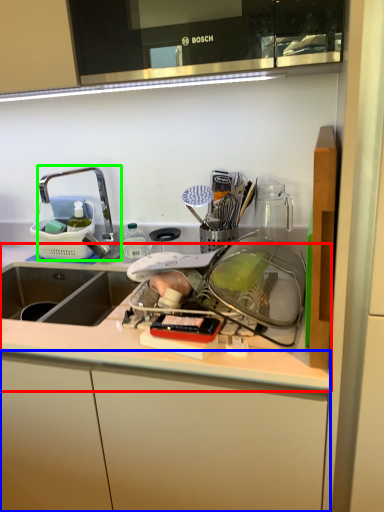
Question: Which object is the farthest from countertop (highlighted by a red box)? Choose among these: cabinetry (highlighted by a blue box) or tap (highlighted by a green box).

Choices:
 (A) cabinetry
 (B) tap

Answer: (B)